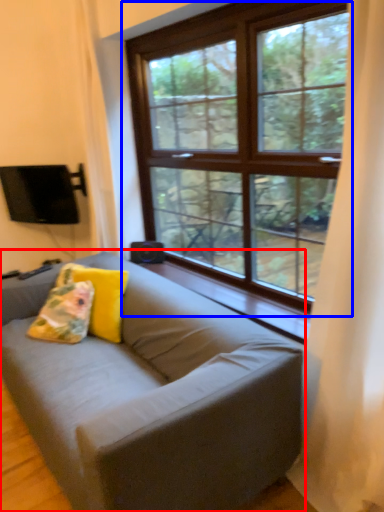
Question: Which object is closer to the camera taking this photo, studio couch (highlighted by a red box) or window (highlighted by a blue box)?

Choices:
 (A) studio couch
 (B) window

Answer: (A)